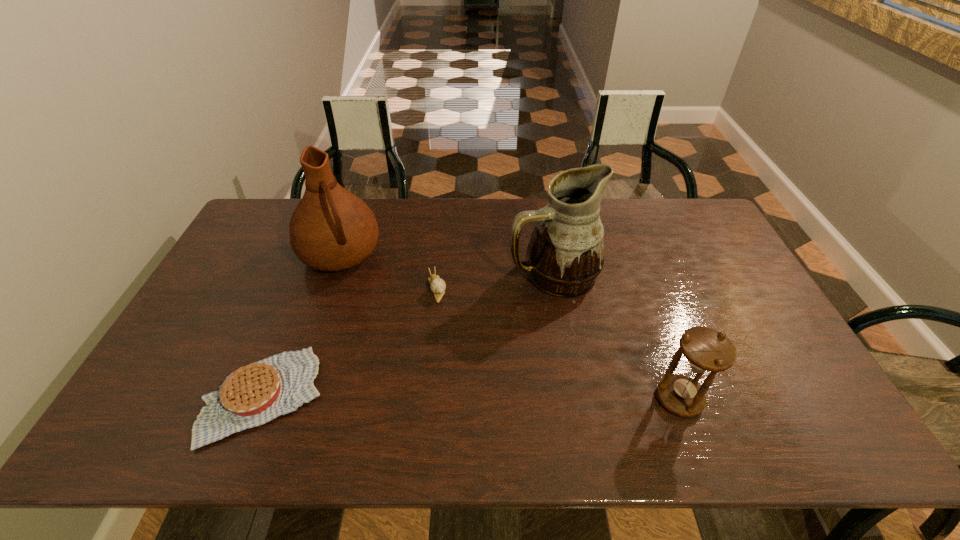
This screenshot has height=540, width=960. Find the location of `vacant space in between the left pitcher and the right pitcher`. vacant space in between the left pitcher and the right pitcher is located at coordinates (446, 265).

Where is `vacant space in between the third object from left to right and the pie`? The image size is (960, 540). vacant space in between the third object from left to right and the pie is located at coordinates (350, 342).

Where is `empty location between the escargot and the right pitcher`? This screenshot has height=540, width=960. empty location between the escargot and the right pitcher is located at coordinates (494, 281).

Where is `unoccupied position between the hourglass and the escargot`? unoccupied position between the hourglass and the escargot is located at coordinates (558, 343).

The width and height of the screenshot is (960, 540). I want to click on vacant space in between the escargot and the pie, so click(x=350, y=342).

Find the location of a particular element. The width and height of the screenshot is (960, 540). vacant point located between the left pitcher and the third object from right to left is located at coordinates (389, 272).

Identify the location of empty space that is in between the left pitcher and the pie. (302, 326).

Locate which object ranks fourth in proximity to the left pitcher. Please provide its 2D coordinates. Your answer should be formatted as a tuple, i.e. [(x, y)], where the tuple contains the x and y coordinates of a point satisfying the conditions above.

[(705, 349)]

Image resolution: width=960 pixels, height=540 pixels. I want to click on object that stands as the fourth closest to the rightmost object, so click(331, 229).

At what (x,y) coordinates should I click in order to perform the action: click on vacant space that satisfies the following two spatial constraints: 1. on the back side of the right pitcher; 2. on the right side of the pie. Please return your answer as a coordinate pair (x, y). Looking at the image, I should click on (311, 274).